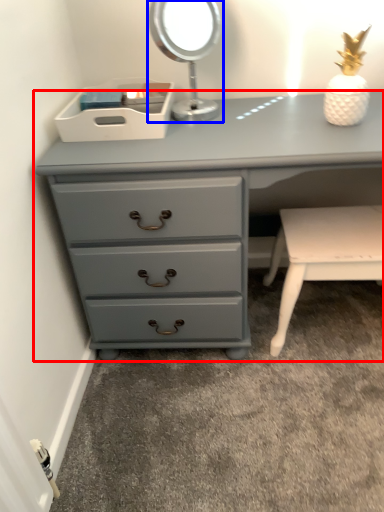
Question: Which object appears closest to the camera in this image, chest of drawers (highlighted by a red box) or bedside lamp (highlighted by a blue box)?

Choices:
 (A) chest of drawers
 (B) bedside lamp

Answer: (A)